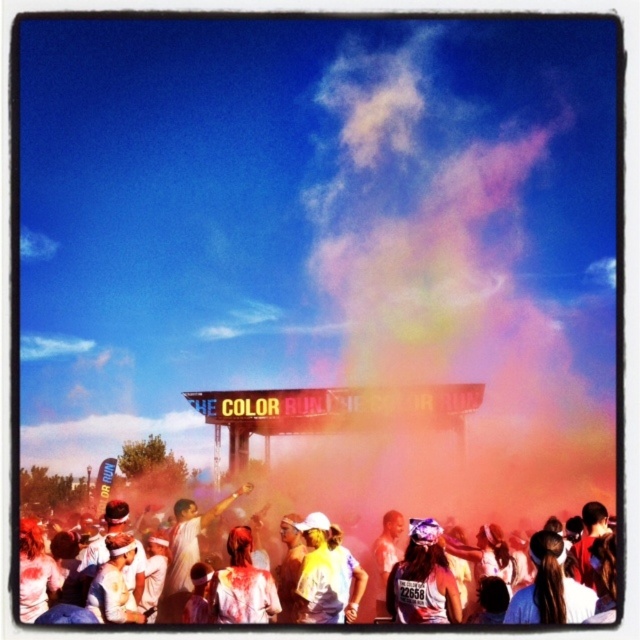
You are a participant in The Color Run and you want to compare your clothing with another runner. You are wearing a white matte shirt at lower center and see a runner wearing a matte white tank top at center. Which clothing item is wider?

The white matte shirt at lower center is wider than the matte white tank top at center.

You are a participant in The Color Run and want to throw colored powder at someone. You are standing near the white matte shirt at lower center. The person you want to target is wearing the matte white tank top at center. Can you accurately throw the powder from your current position to reach them?

The distance between the white matte shirt at lower center and the matte white tank top at center is 9.15 meters. Depending on your throwing ability, this distance may be challenging, but it is possible if you can throw accurately over 9.15 meters.

You are a participant in The Color Run and want to know how far the point at coordinates point (444, 538) is from you. Can you determine the distance?

The point (444, 538) is 152.61 meters away from you.